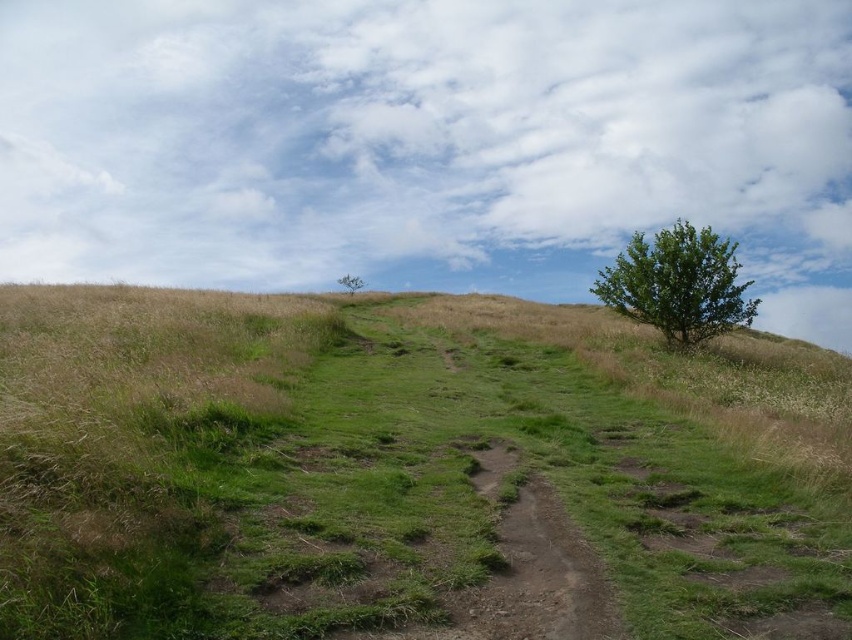
Who is lower down, green leafy tree at right or green leafy tree at center?

green leafy tree at right

Who is more forward, (625, 296) or (350, 280)?

Point (625, 296) is more forward.

Does point (608, 288) come farther from viewer compared to point (355, 289)?

No, (608, 288) is closer to viewer.

This screenshot has width=852, height=640. I want to click on green leafy tree at right, so click(x=678, y=284).

Is point (573, 572) positioned before point (586, 620)?

That is False.

Between point (459, 314) and point (567, 632), which one is positioned in front?

Positioned in front is point (567, 632).

This screenshot has height=640, width=852. What do you see at coordinates (407, 470) in the screenshot?
I see `green grassy at center` at bounding box center [407, 470].

This screenshot has height=640, width=852. I want to click on green grassy at center, so click(x=407, y=470).

Is green grassy at center positioned behind green leafy tree at center?

No.

Does point (300, 387) come farther from viewer compared to point (361, 285)?

No, it is not.

Find the location of a particular element. The height and width of the screenshot is (640, 852). green grassy at center is located at coordinates (407, 470).